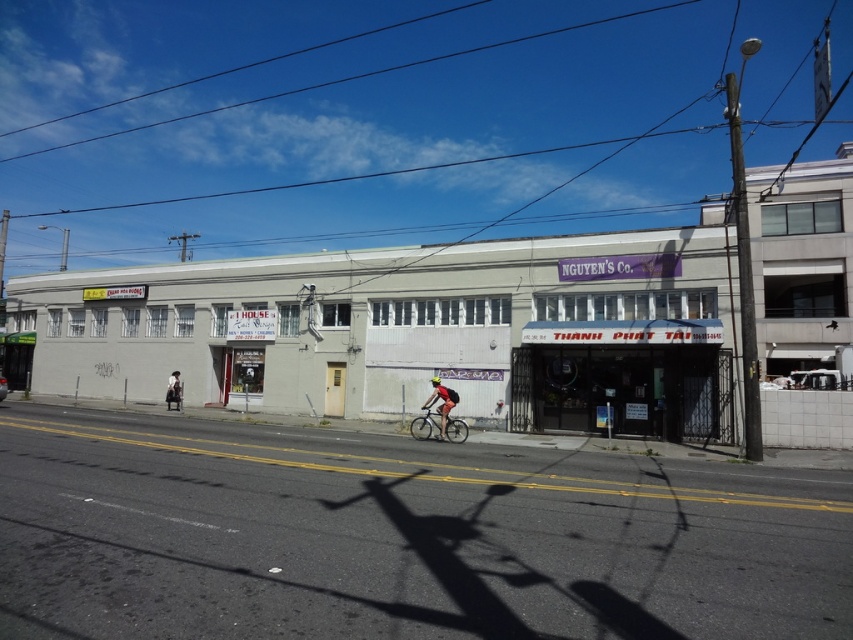
Is point (467, 435) closer to camera compared to point (178, 376)?

Yes, it is.

Consider the image. Is shiny metallic bicycle at center to the left of light brown leather jacket at center from the viewer's perspective?

Incorrect, shiny metallic bicycle at center is not on the left side of light brown leather jacket at center.

Does point (428, 424) lie behind point (178, 396)?

No, (428, 424) is closer to viewer.

The height and width of the screenshot is (640, 853). I want to click on shiny metallic bicycle at center, so click(424, 422).

Does point (683, 333) come farther from viewer compared to point (169, 381)?

No, (683, 333) is in front of (169, 381).

Does metallic silver storefront at center have a lesser height compared to light brown leather jacket at center?

Indeed, metallic silver storefront at center has a lesser height compared to light brown leather jacket at center.

Is point (689, 374) in front of point (170, 372)?

Yes, it is.

The image size is (853, 640). I want to click on metallic silver storefront at center, so click(619, 378).

Does shiny red bicycle at center have a lesser width compared to light brown leather jacket at center?

Yes, shiny red bicycle at center is thinner than light brown leather jacket at center.

Does shiny red bicycle at center appear on the left side of light brown leather jacket at center?

Incorrect, shiny red bicycle at center is not on the left side of light brown leather jacket at center.

Is point (445, 417) farther from camera compared to point (170, 385)?

That is False.

Identify the location of shiny red bicycle at center. click(x=440, y=403).